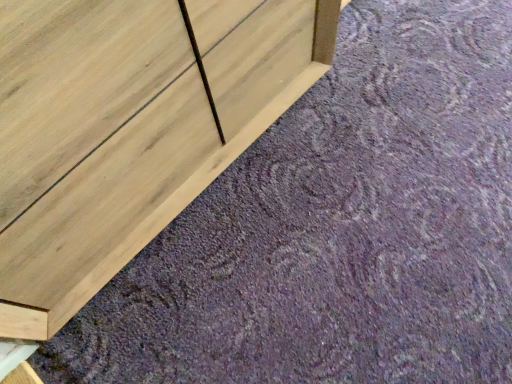
I want to click on natural wood chest of drawers at upper left, so coord(129,128).

The width and height of the screenshot is (512, 384). Describe the element at coordinates (129, 128) in the screenshot. I see `natural wood chest of drawers at upper left` at that location.

Where is `natural wood chest of drawers at upper left`? natural wood chest of drawers at upper left is located at coordinates (129, 128).